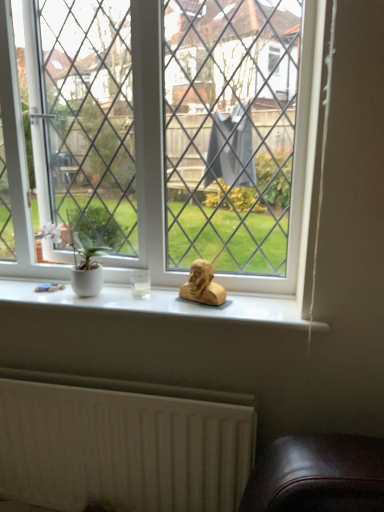
Where is `free location above white textured radiator at lower left (from a real-world perspective)`? The height and width of the screenshot is (512, 384). free location above white textured radiator at lower left (from a real-world perspective) is located at coordinates (102, 382).